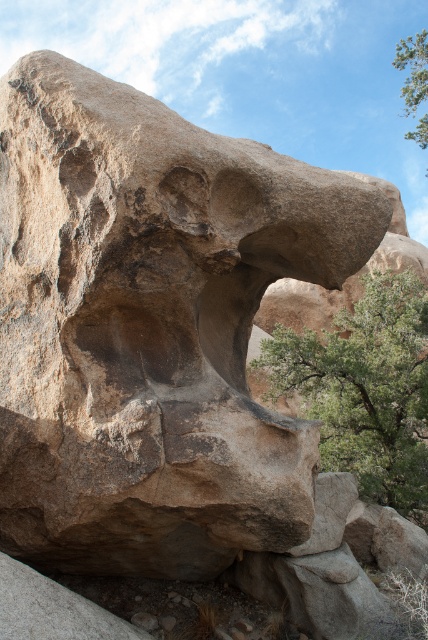
You are standing at the base of the large rock formation and want to take a photo of the green leafy tree at center. If your camera has a maximum zoom range of 15 feet, will you need to move closer to the tree to capture it in focus?

The green leafy tree at center is 17.71 feet away from the viewer. Since the camera can only zoom up to 15 feet, you need to move closer to the tree to capture it in focus.

You are standing at the camera position looking at the large rock formation. There is a specific point marked at coordinates point (338, 333) on the rock. If you want to touch this point with a 8 meter long stick, will the stick reach it?

The point (338, 333) is 8.38 meters away from the camera. Since the stick is only 8 meters long, it is 0.38 meters shorter than needed. Therefore, the stick will not reach the point.

Looking at this image, you are a hiker who wants to take a photo of both the green leafy tree at center and the green leafy tree at upper right in the same frame. Which tree should you move closer to in order to include both trees in your photo?

You should move closer to the green leafy tree at center because it is smaller in width compared to the green leafy tree at upper right. By moving closer to the smaller tree, you can fit both trees within the camera frame more easily.